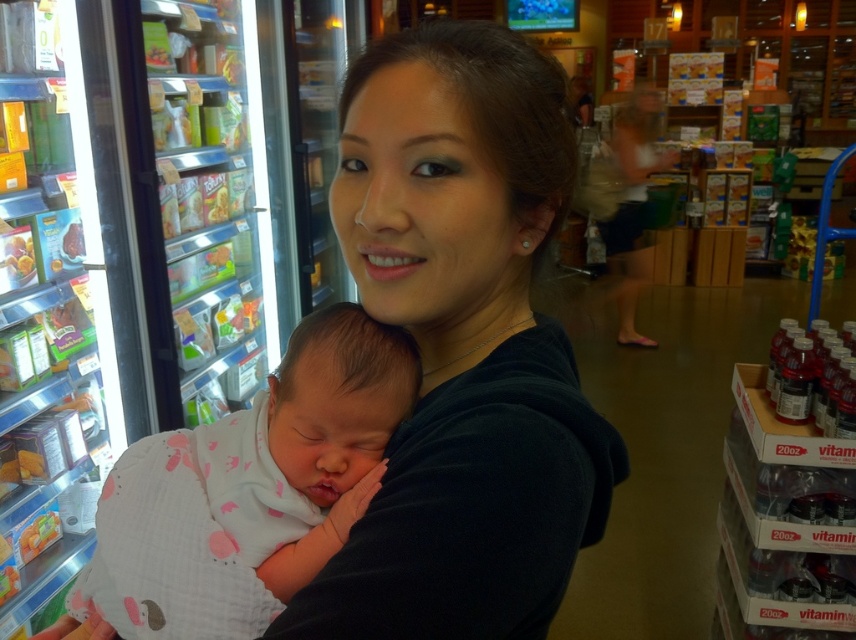
You are a photographer trying to capture a closeup of the baby in the center. The black matte shirt at center and the white cotton swaddle at center are both in the frame. Which item should you adjust to get a clearer focus on the baby?

The black matte shirt at center is larger in size than the white cotton swaddle at center, so you should adjust the black matte shirt at center to move it out of the way to get a clearer focus on the baby.

You are a photographer setting up a shoot in a grocery store. You have a camera that requires a minimum of 1 meter between the subject and the background to focus properly. The subject is the woman wearing the black matte shirt at center holding the white cotton swaddle at center. Given the spatial arrangement described, will your camera be able to focus properly?

The black matte shirt at center and white cotton swaddle at center are both at the center, so their positions do not affect the distance to the background. The camera should be able to focus properly as long as the total distance from the subject to the background meets the 1 meter requirement, which isn